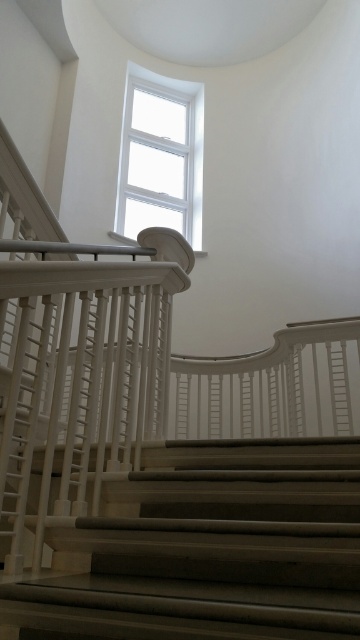
Locate an element on the screen. smooth beige stairs at center is located at coordinates (208, 548).

This screenshot has height=640, width=360. Describe the element at coordinates (208, 548) in the screenshot. I see `smooth beige stairs at center` at that location.

Looking at this image, who is more forward, (132, 520) or (186, 88)?

Point (132, 520) is more forward.

You are a GUI agent. You are given a task and a screenshot of the screen. Output one action in this format:
    pyautogui.click(x=<x>, y=<y>)
    Task: Click on the smooth beige stairs at center
    Image resolution: width=360 pixels, height=640 pixels.
    Given the screenshot: What is the action you would take?
    pyautogui.click(x=208, y=548)